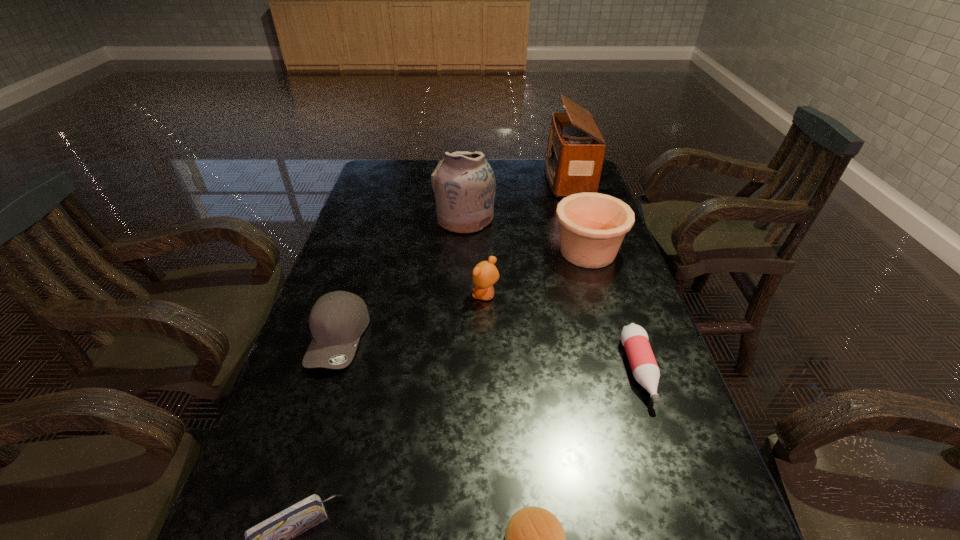
Where is `bottle that is at the right edge`? The height and width of the screenshot is (540, 960). bottle that is at the right edge is located at coordinates (634, 338).

Where is `object located in the far right corner section of the desktop`? object located in the far right corner section of the desktop is located at coordinates (575, 151).

Where is `free space at the far edge of the desktop`? The height and width of the screenshot is (540, 960). free space at the far edge of the desktop is located at coordinates (430, 176).

In the image, there is a desktop. Find the location of `vacant space at the left edge`. vacant space at the left edge is located at coordinates (335, 285).

This screenshot has height=540, width=960. In the image, there is a desktop. What are the coordinates of `free space at the right edge` in the screenshot? It's located at (684, 520).

I want to click on vacant region at the far left corner of the desktop, so click(396, 178).

Identify the location of empty location between the fifth nearest object and the right pottery. The image size is (960, 540). [537, 274].

You are a GUI agent. You are given a task and a screenshot of the screen. Output one action in this format:
    pyautogui.click(x=<x>, y=<y>)
    Task: Click on the free spot between the right pottery and the third shortest object
    The image size is (960, 540).
    Given the screenshot: What is the action you would take?
    pyautogui.click(x=613, y=311)

Locate an element on the screen. The image size is (960, 540). vacant point located between the left pottery and the baseball cap is located at coordinates (401, 278).

At what (x,y) coordinates should I click in order to perform the action: click on vacant point located between the teddy bear and the fourth shortest object. Please return your answer as a coordinate pair (x, y). Looking at the image, I should click on (412, 316).